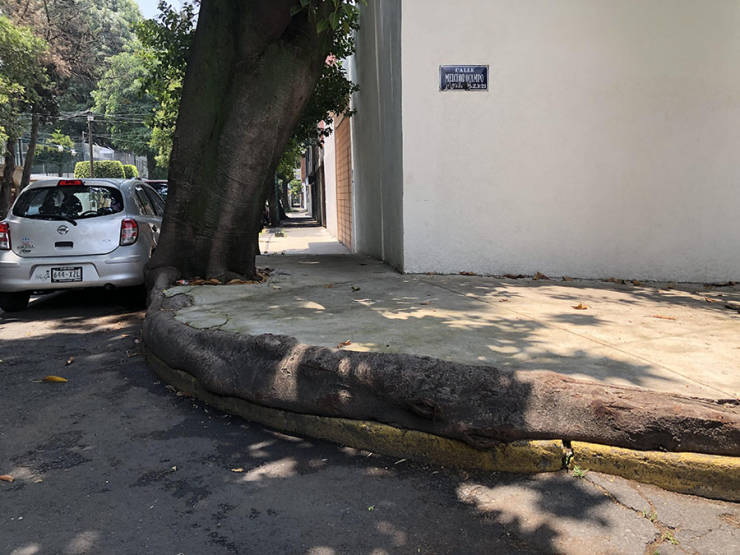
Locate an element on the screen. This screenshot has width=740, height=555. wall is located at coordinates (573, 131).